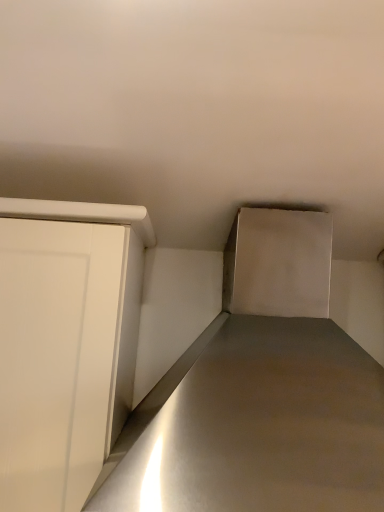
What do you see at coordinates (257, 424) in the screenshot? This screenshot has height=512, width=384. I see `satin silver counter top at center` at bounding box center [257, 424].

Measure the distance between point (365, 394) and camera.

The distance of point (365, 394) from camera is 30.31 inches.

Image resolution: width=384 pixels, height=512 pixels. Identify the location of satin silver counter top at center. (257, 424).

The image size is (384, 512). What do you see at coordinates (55, 358) in the screenshot? I see `white matte door at left` at bounding box center [55, 358].

Find the location of a particular element. white matte door at left is located at coordinates (55, 358).

Measure the distance between white matte door at left and camera.

white matte door at left and camera are 26.63 inches apart from each other.

This screenshot has height=512, width=384. In order to click on satin silver counter top at center in this screenshot , I will do `click(257, 424)`.

Between satin silver counter top at center and white matte door at left, which one appears on the right side from the viewer's perspective?

satin silver counter top at center.

Is satin silver counter top at center in front of or behind white matte door at left in the image?

satin silver counter top at center is positioned closer to the viewer than white matte door at left.

Considering the points (245, 502) and (89, 351), which point is behind, point (245, 502) or point (89, 351)?

The point (89, 351) is behind.

From the image's perspective, is satin silver counter top at center located beneath white matte door at left?

No.

From a real-world perspective, is satin silver counter top at center located higher than white matte door at left?

Indeed, from a real-world perspective, satin silver counter top at center stands above white matte door at left.

Looking at their sizes, would you say satin silver counter top at center is wider or thinner than white matte door at left?

In the image, satin silver counter top at center appears to be wider than white matte door at left.

Considering the sizes of objects satin silver counter top at center and white matte door at left in the image provided, who is shorter, satin silver counter top at center or white matte door at left?

With less height is satin silver counter top at center.

Based on their sizes in the image, would you say satin silver counter top at center is bigger or smaller than white matte door at left?

Considering their sizes, satin silver counter top at center takes up more space than white matte door at left.

Is satin silver counter top at center not within white matte door at left?

satin silver counter top at center is positioned outside white matte door at left.

Based on the photo, is satin silver counter top at center placed right next to white matte door at left?

No, satin silver counter top at center is not in contact with white matte door at left.

Could you tell me if satin silver counter top at center is facing white matte door at left?

No.

The width and height of the screenshot is (384, 512). In the image, there is a white matte door at left. Identify the location of counter top above it (from the image's perspective). (257, 424).

Is white matte door at left at the left side of satin silver counter top at center?

Yes.

Relative to satin silver counter top at center, is white matte door at left in front or behind?

white matte door at left is positioned farther from the viewer than satin silver counter top at center.

Does point (12, 357) come in front of point (286, 481)?

No, it is behind (286, 481).

Based on the photo, from the image's perspective, is white matte door at left positioned above or below satin silver counter top at center?

white matte door at left is below satin silver counter top at center.

From a real-world perspective, which object rests below the other?

white matte door at left.

Is white matte door at left wider than satin silver counter top at center?

No, white matte door at left is not wider than satin silver counter top at center.

Considering the sizes of white matte door at left and satin silver counter top at center in the image, is white matte door at left taller or shorter than satin silver counter top at center?

Clearly, white matte door at left is taller compared to satin silver counter top at center.

Considering the sizes of objects white matte door at left and satin silver counter top at center in the image provided, who is smaller, white matte door at left or satin silver counter top at center?

Smaller between the two is white matte door at left.

Is white matte door at left inside the boundaries of satin silver counter top at center, or outside?

white matte door at left is spatially situated outside satin silver counter top at center.

Are white matte door at left and satin silver counter top at center beside each other?

No, white matte door at left is not making contact with satin silver counter top at center.

Is white matte door at left oriented away from satin silver counter top at center?

white matte door at left does not have its back to satin silver counter top at center.

What's the angular difference between white matte door at left and satin silver counter top at center's facing directions?

They differ by 0.0026 degrees in their facing directions.

Locate an element on the screen. counter top located above the white matte door at left (from the image's perspective) is located at coordinates (257, 424).

At what (x,y) coordinates should I click in order to perform the action: click on counter top on the right of white matte door at left. Please return your answer as a coordinate pair (x, y). Looking at the image, I should click on (257, 424).

What are the coordinates of `door located underneath the satin silver counter top at center (from a real-world perspective)` in the screenshot? It's located at (55, 358).